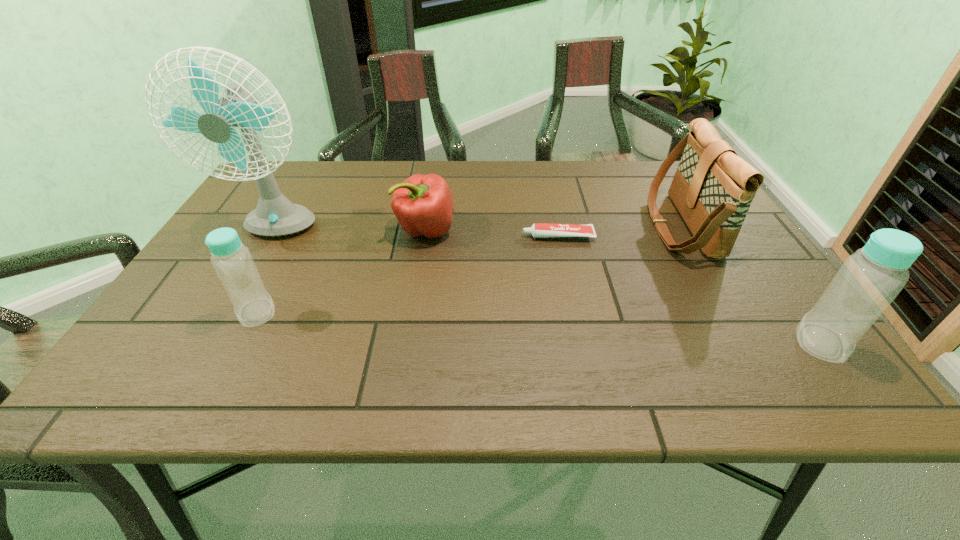
Please point a location where one more bottle can be added evenly. Please provide its 2D coordinates. Your answer should be formatted as a tuple, i.e. [(x, y)], where the tuple contains the x and y coordinates of a point satisfying the conditions above.

[(530, 327)]